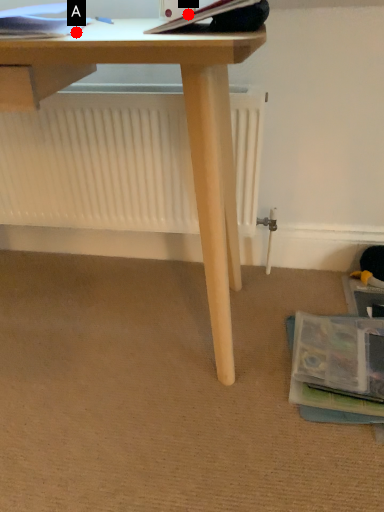
Question: Two points are circled on the image, labeled by A and B beside each circle. Which point appears farthest from the camera in this image?

Choices:
 (A) A is further
 (B) B is further

Answer: (A)